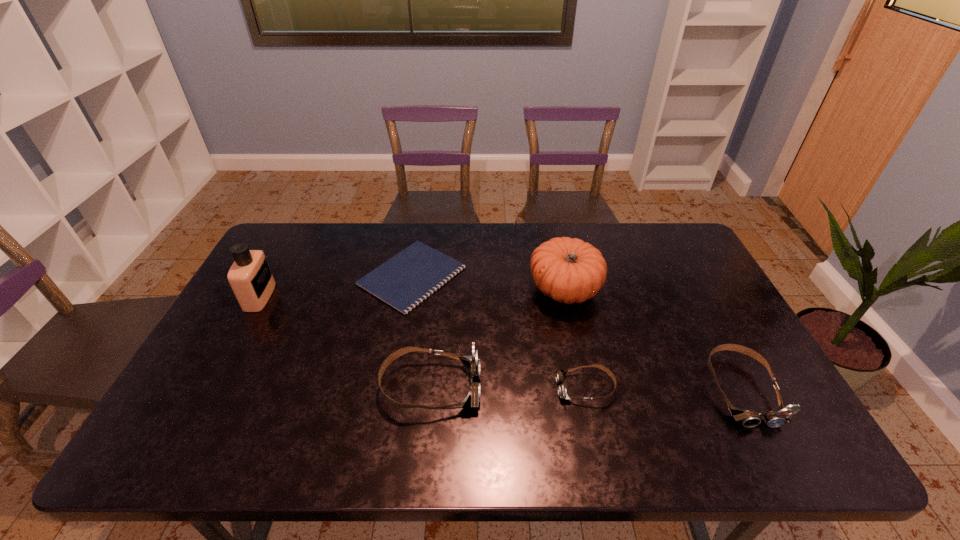
Identify the location of free location that satisfies the following two spatial constraints: 1. on the front side of the shortest object; 2. on the front label of the perfume. (408, 296).